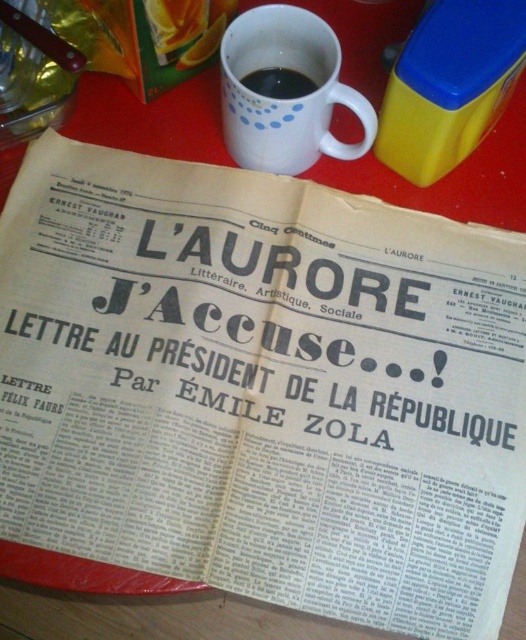
Question: Among these objects, which one is farthest from the camera?

Choices:
 (A) white matte mug at upper center
 (B) black matte mug at upper center

Answer: (B)

Question: Which point is closer to the camera?

Choices:
 (A) white matte mug at upper center
 (B) black matte mug at upper center

Answer: (A)

Question: Observing the image, what is the correct spatial positioning of white matte mug at upper center in reference to black matte mug at upper center?

Choices:
 (A) right
 (B) left

Answer: (A)

Question: Does white matte mug at upper center appear under black matte mug at upper center?

Choices:
 (A) yes
 (B) no

Answer: (A)

Question: Does white matte mug at upper center appear on the right side of black matte mug at upper center?

Choices:
 (A) yes
 (B) no

Answer: (A)